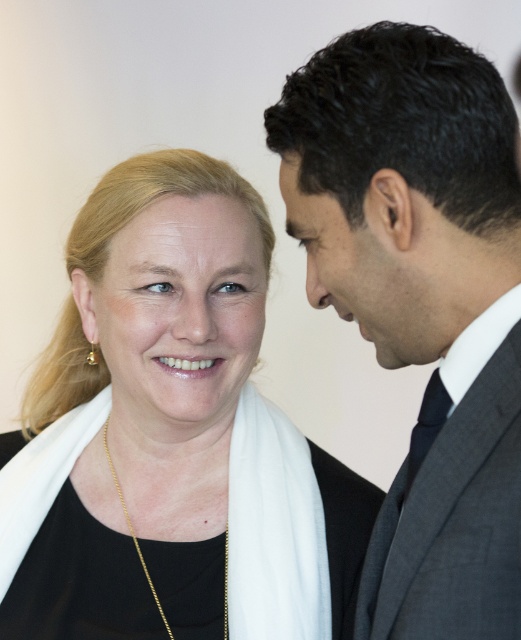
You are a photographer taking a portrait of the two people in the scene. You notice the matte black scarf at left and the smooth skin at upper center. Which object is positioned to the left of the other?

The matte black scarf at left is to the left of smooth skin at upper center.

From the picture: Based on the scene description, can you determine the exact 2D coordinates of the dark gray wool suit at right?

The dark gray wool suit at right is located at the 2D coordinates of point (455, 502).

You are an artist sketching the scene. You need to draw the matte black scarf at left and smooth skin at upper center. Which object should you draw first to maintain proper spatial arrangement?

The smooth skin at upper center is above the matte black scarf at left, so you should draw the smooth skin at upper center first to ensure the scarf is placed below it in the sketch.